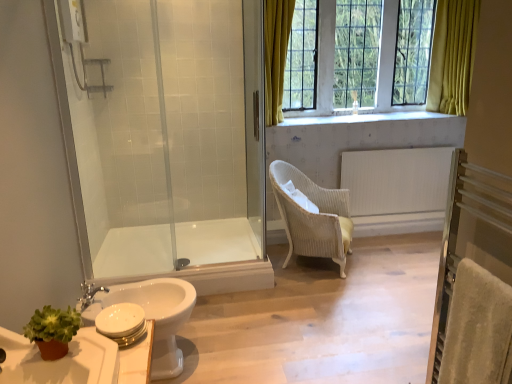
Where is `vacant space to the left of clear glass shower door at center`? vacant space to the left of clear glass shower door at center is located at coordinates (215, 242).